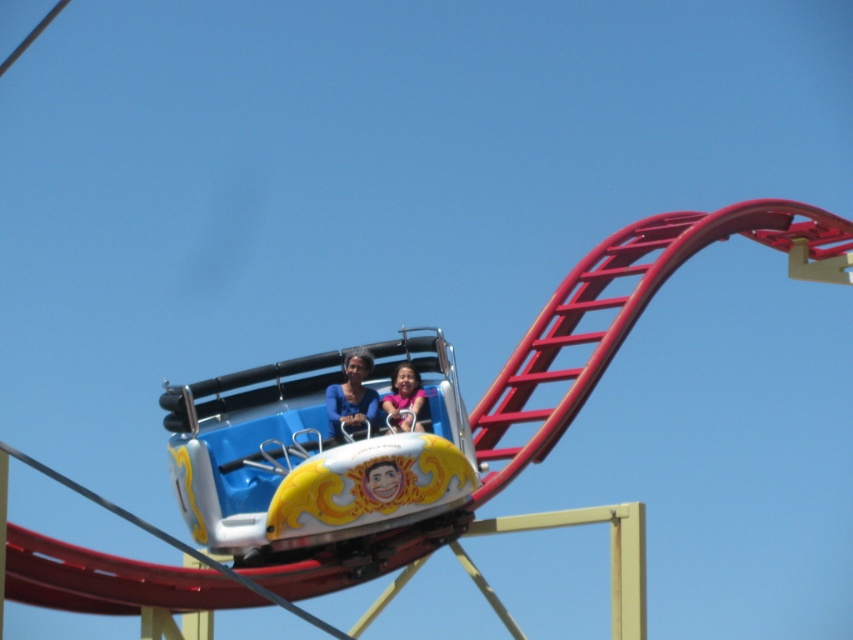
Question: Which point is closer to the camera taking this photo?

Choices:
 (A) (413, 378)
 (B) (235, 378)
 (C) (357, 365)

Answer: (C)

Question: Which point is farther to the camera?

Choices:
 (A) matte blue shirt at center
 (B) matte pink shirt at center

Answer: (B)

Question: Does matte blue shirt at center have a greater width compared to matte pink shirt at center?

Choices:
 (A) no
 (B) yes

Answer: (B)

Question: Can you confirm if matte blue shirt at center is positioned below matte pink shirt at center?

Choices:
 (A) yes
 (B) no

Answer: (B)

Question: Which of the following is the closest to the observer?

Choices:
 (A) (398, 348)
 (B) (399, 419)
 (C) (332, 406)

Answer: (B)

Question: Can you confirm if matte blue shirt at center is positioned to the right of matte pink shirt at center?

Choices:
 (A) yes
 (B) no

Answer: (B)